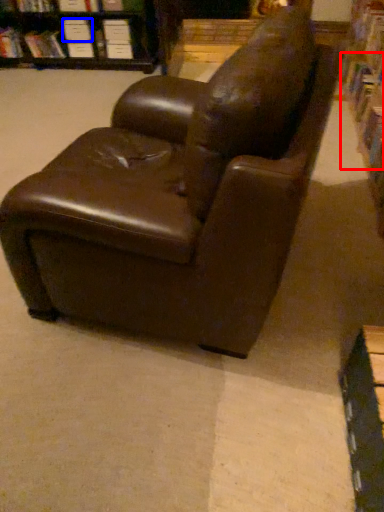
Question: Among these objects, which one is nearest to the camera, book (highlighted by a red box) or paperback book (highlighted by a blue box)?

Choices:
 (A) book
 (B) paperback book

Answer: (A)